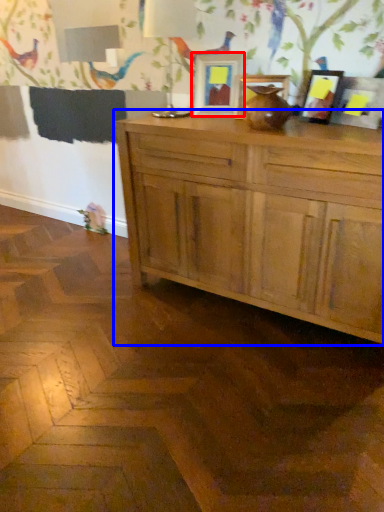
Question: Which object is closer to the camera taking this photo, picture frame (highlighted by a red box) or cabinetry (highlighted by a blue box)?

Choices:
 (A) picture frame
 (B) cabinetry

Answer: (B)